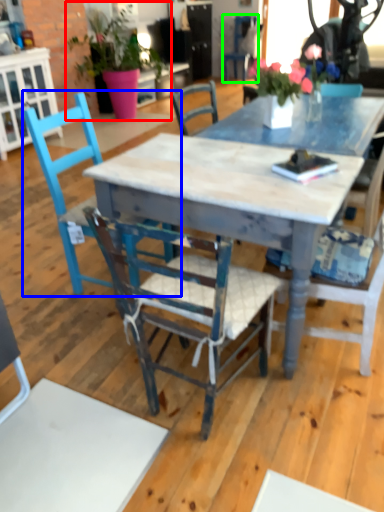
Question: Estimate the real-world distances between objects in this image. Which object is farther from houseplant (highlighted by a red box), chair (highlighted by a blue box) or chair (highlighted by a green box)?

Choices:
 (A) chair
 (B) chair

Answer: (A)